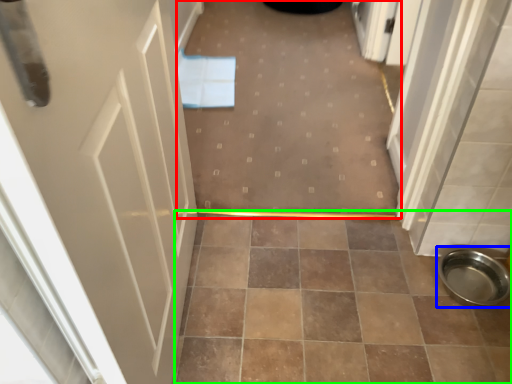
Question: Considering the real-world distances, which object is closest to plain (highlighted by a red box)? toilet bowl (highlighted by a blue box) or ceramic tile (highlighted by a green box).

Choices:
 (A) toilet bowl
 (B) ceramic tile

Answer: (B)